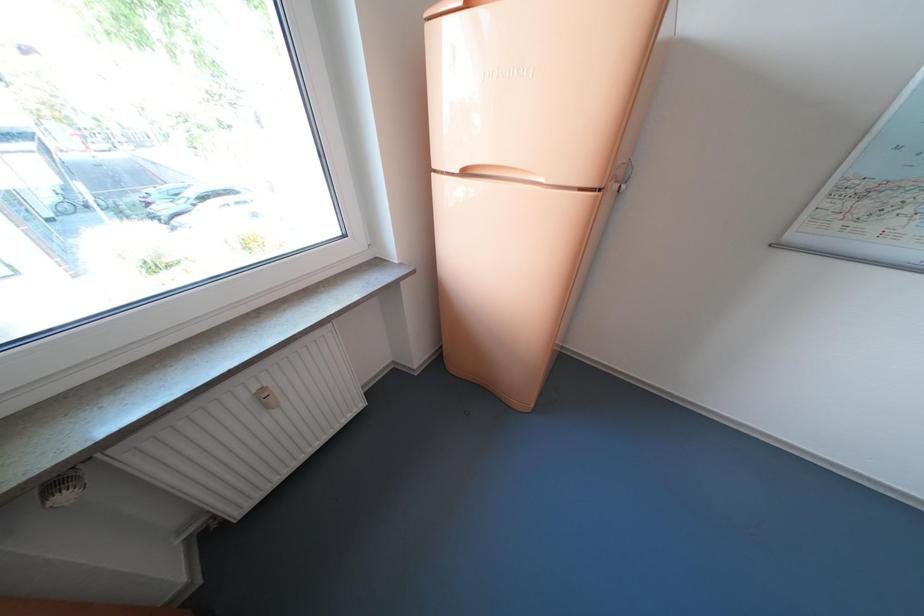
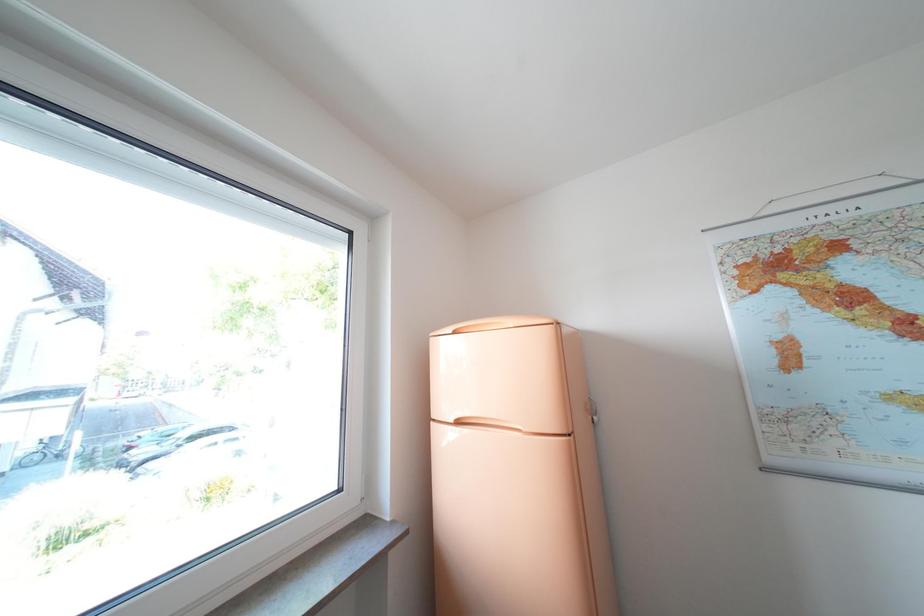
Question: The images are taken continuously from a first-person perspective. In which direction is your viewpoint rotating?

Choices:
 (A) Left
 (B) Right
 (C) Up
 (D) Down

Answer: (C)